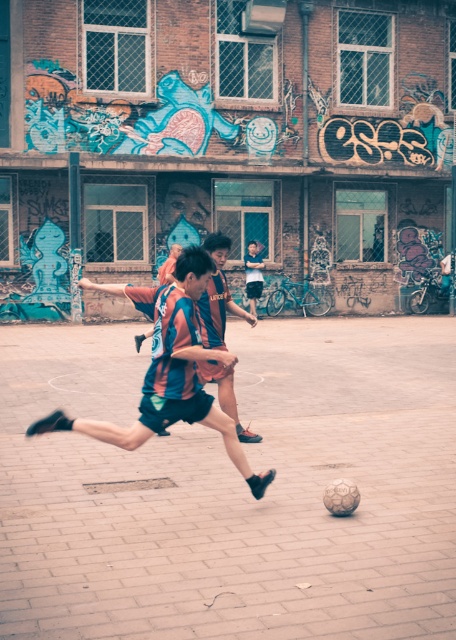
Can you confirm if multicolored jersey at center is smaller than light blue denim shorts at center?

Yes, multicolored jersey at center is smaller than light blue denim shorts at center.

The height and width of the screenshot is (640, 456). I want to click on multicolored jersey at center, so click(x=217, y=296).

Which is behind, point (171, 305) or point (203, 292)?

The point (203, 292) is more distant.

Does striped jersey at center have a lesser height compared to multicolored jersey at center?

In fact, striped jersey at center may be taller than multicolored jersey at center.

Measure the distance between striped jersey at center and camera.

striped jersey at center and camera are 6.13 meters apart from each other.

Find the location of a particular element. striped jersey at center is located at coordinates pyautogui.click(x=169, y=369).

Between striped jersey at center and light blue denim shorts at center, which one has more height?

Standing taller between the two is striped jersey at center.

Image resolution: width=456 pixels, height=640 pixels. In order to click on striped jersey at center in this screenshot , I will do `click(169, 369)`.

Is point (139, 305) closer to camera compared to point (253, 244)?

That is True.

The width and height of the screenshot is (456, 640). I want to click on striped jersey at center, so click(x=169, y=369).